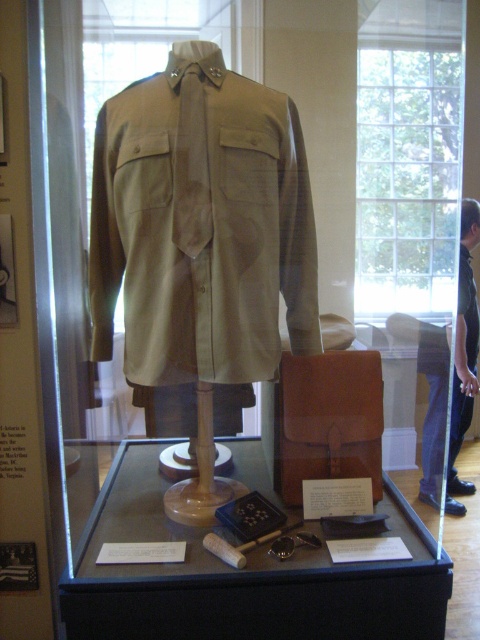
Question: Which point is farther to the camera?

Choices:
 (A) khaki fabric shirt at center
 (B) black leather pants at lower right
 (C) khaki cotton shirt at center
 (D) matte brown leather case at center

Answer: (B)

Question: Considering the real-world distances, which object is closest to the khaki cotton shirt at center?

Choices:
 (A) khaki fabric shirt at center
 (B) black leather pants at lower right
 (C) matte brown leather case at center

Answer: (C)

Question: Considering the real-world distances, which object is closest to the matte brown leather case at center?

Choices:
 (A) khaki cotton shirt at center
 (B) black leather pants at lower right
 (C) khaki fabric shirt at center

Answer: (A)

Question: Is black leather pants at lower right to the left of khaki fabric shirt at center from the viewer's perspective?

Choices:
 (A) yes
 (B) no

Answer: (A)

Question: Does matte brown leather case at center appear over black leather pants at lower right?

Choices:
 (A) yes
 (B) no

Answer: (B)

Question: Can you confirm if matte brown leather case at center is positioned to the left of black leather pants at lower right?

Choices:
 (A) yes
 (B) no

Answer: (A)